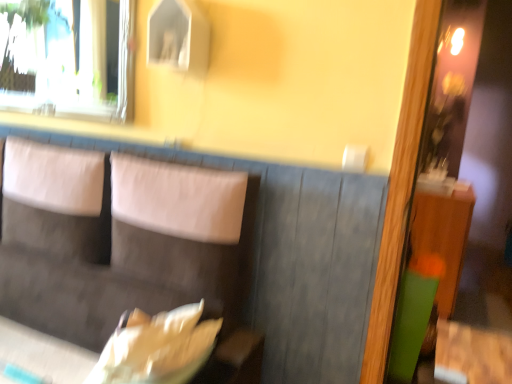
Describe the element at coordinates (148, 264) in the screenshot. This screenshot has width=512, height=384. I see `suede-like gray couch at center` at that location.

Find the location of a particular element. Image resolution: width=512 pixels, height=384 pixels. suede-like gray couch at center is located at coordinates (148, 264).

Looking at this image, what is the approximate width of suede-like gray couch at center?

3.76 inches.

Locate an element on the screen. transparent glass window at upper left is located at coordinates (65, 59).

In order to face transparent glass window at upper left, should I rotate leftwards or rightwards?

You should look left and rotate roughly 25.410 degrees.

Based on the photo, what is the approximate height of transparent glass window at upper left?

transparent glass window at upper left is 21.43 inches tall.

What do you see at coordinates (65, 59) in the screenshot? I see `transparent glass window at upper left` at bounding box center [65, 59].

Locate an element on the screen. This screenshot has width=512, height=384. suede-like gray couch at center is located at coordinates (148, 264).

Visually, is suede-like gray couch at center positioned to the left or to the right of transparent glass window at upper left?

suede-like gray couch at center is to the right of transparent glass window at upper left.

Between suede-like gray couch at center and transparent glass window at upper left, which one is positioned in front?

suede-like gray couch at center is closer to the camera.

Does point (64, 279) come closer to viewer compared to point (12, 20)?

Yes, it is.

From the image's perspective, would you say suede-like gray couch at center is shown under transparent glass window at upper left?

Yes, from the image's perspective, suede-like gray couch at center is beneath transparent glass window at upper left.

From a real-world perspective, is suede-like gray couch at center positioned over transparent glass window at upper left based on gravity?

No, from a real-world perspective, suede-like gray couch at center is not on top of transparent glass window at upper left.

Considering the sizes of objects suede-like gray couch at center and transparent glass window at upper left in the image provided, who is wider, suede-like gray couch at center or transparent glass window at upper left?

suede-like gray couch at center.

Between suede-like gray couch at center and transparent glass window at upper left, which one has more height?

With more height is suede-like gray couch at center.

Considering the sizes of objects suede-like gray couch at center and transparent glass window at upper left in the image provided, who is smaller, suede-like gray couch at center or transparent glass window at upper left?

transparent glass window at upper left is smaller.

In the scene shown: Is transparent glass window at upper left surrounded by suede-like gray couch at center?

No, suede-like gray couch at center does not contain transparent glass window at upper left.

Looking at this image, would you consider suede-like gray couch at center to be distant from transparent glass window at upper left?

Indeed, suede-like gray couch at center is not near transparent glass window at upper left.

Is suede-like gray couch at center positioned with its back to transparent glass window at upper left?

No, transparent glass window at upper left is not at the back of suede-like gray couch at center.

What's the angular difference between suede-like gray couch at center and transparent glass window at upper left's facing directions?

0.434 degrees.

The height and width of the screenshot is (384, 512). I want to click on window above the suede-like gray couch at center (from the image's perspective), so click(65, 59).

Which object is positioned more to the right, transparent glass window at upper left or suede-like gray couch at center?

Positioned to the right is suede-like gray couch at center.

Is transparent glass window at upper left in front of or behind suede-like gray couch at center in the image?

transparent glass window at upper left is behind suede-like gray couch at center.

Between point (104, 68) and point (215, 259), which one is positioned in front?

The point (215, 259) is more forward.

From the image's perspective, is transparent glass window at upper left positioned above or below suede-like gray couch at center?

From the image's perspective, transparent glass window at upper left appears above suede-like gray couch at center.

From a real-world perspective, is transparent glass window at upper left located beneath suede-like gray couch at center?

No.

Consider the image. Which object is wider, transparent glass window at upper left or suede-like gray couch at center?

Wider between the two is suede-like gray couch at center.

Does transparent glass window at upper left have a greater height compared to suede-like gray couch at center?

Incorrect, the height of transparent glass window at upper left is not larger of that of suede-like gray couch at center.

Who is bigger, transparent glass window at upper left or suede-like gray couch at center?

suede-like gray couch at center.

In the scene shown: Does transparent glass window at upper left contain suede-like gray couch at center?

No, suede-like gray couch at center is not inside transparent glass window at upper left.

Is transparent glass window at upper left with suede-like gray couch at center?

No, transparent glass window at upper left is not in contact with suede-like gray couch at center.

Could you tell me if transparent glass window at upper left is turned towards suede-like gray couch at center?

No, transparent glass window at upper left is not facing towards suede-like gray couch at center.

What's the angular difference between transparent glass window at upper left and suede-like gray couch at center's facing directions?

They differ by 0.434 degrees in their facing directions.

Measure the distance from transparent glass window at upper left to suede-like gray couch at center.

A distance of 2.90 meters exists between transparent glass window at upper left and suede-like gray couch at center.

Locate an element on the screen. The image size is (512, 384). window above the suede-like gray couch at center (from the image's perspective) is located at coordinates (65, 59).

The height and width of the screenshot is (384, 512). What are the coordinates of `couch that appears below the transparent glass window at upper left (from the image's perspective)` in the screenshot? It's located at [148, 264].

Identify the location of window behind the suede-like gray couch at center. (65, 59).